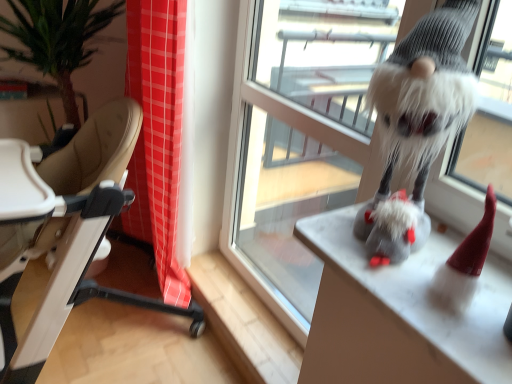
Identify the location of vacant area to the right of fuzzy gray gnome at upper right. This screenshot has height=384, width=512. (456, 243).